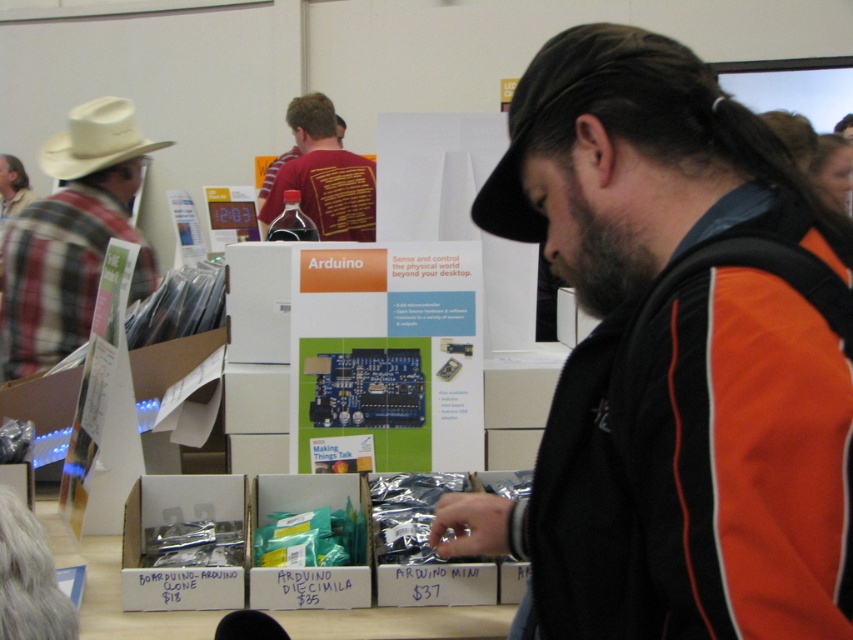
Question: Among these objects, which one is nearest to the camera?

Choices:
 (A) matte red shirt at upper center
 (B) orange and black jacket at center
 (C) metallic silver arduino clone at lower left
 (D) white leather cowboy hat at left

Answer: (B)

Question: Does orange and black jacket at center appear under matte red shirt at upper center?

Choices:
 (A) no
 (B) yes

Answer: (B)

Question: Which point is closer to the camera taking this photo?

Choices:
 (A) (200, 502)
 (B) (331, 141)

Answer: (A)

Question: Which point is closer to the camera taking this photo?

Choices:
 (A) (78, 116)
 (B) (161, 576)
 (C) (283, 600)

Answer: (B)

Question: Is orange and black jacket at center closer to the viewer compared to teal plastic box at center?

Choices:
 (A) no
 (B) yes

Answer: (B)

Question: Is metallic silver arduino clone at lower left bigger than teal plastic box at center?

Choices:
 (A) yes
 (B) no

Answer: (A)